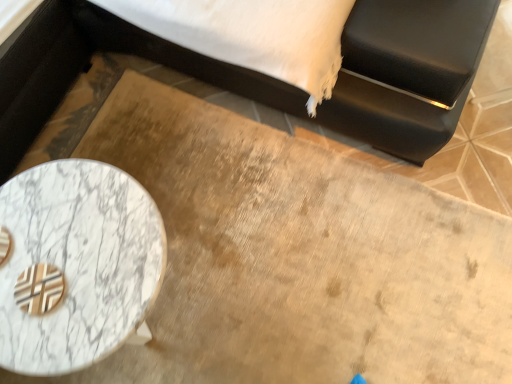
This screenshot has height=384, width=512. Identify the location of free space above marble table at lower left (from a real-world perspective). (71, 258).